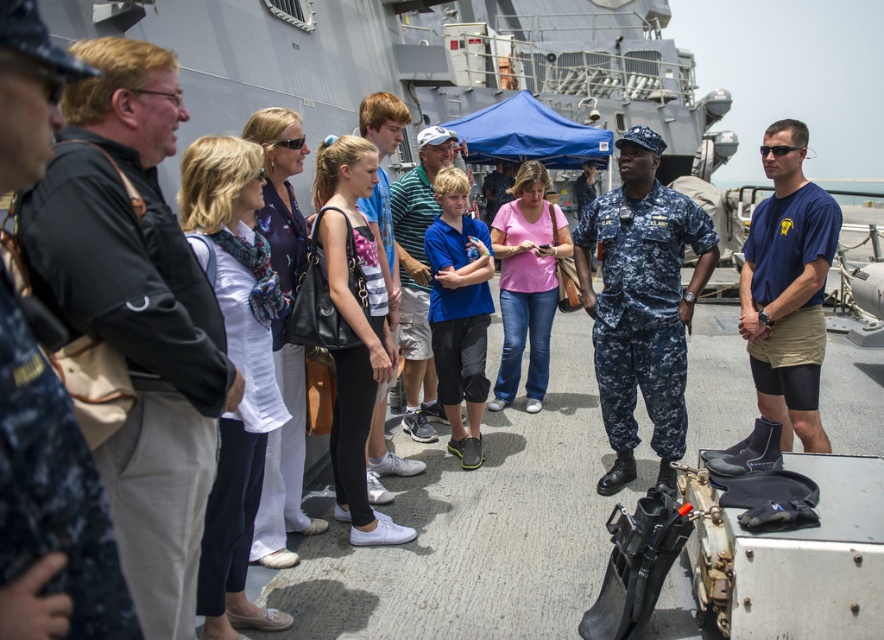
Is point (120, 529) more distant than point (418, 406)?

No, it is in front of (418, 406).

The image size is (884, 640). Identify the location of black leather jacket at left. (136, 314).

Who is positioned more to the right, black leather jacket at left or blue cotton t-shirt at center-right?

blue cotton t-shirt at center-right is more to the right.

Between black leather jacket at left and blue cotton t-shirt at center-right, which one is positioned lower?

black leather jacket at left is lower down.

Between point (75, 161) and point (789, 424), which one is positioned behind?

Positioned behind is point (789, 424).

Where is `black leather jacket at left`? This screenshot has height=640, width=884. black leather jacket at left is located at coordinates 136,314.

Who is more forward, (767, 349) or (398, 209)?

Point (767, 349) is more forward.

Does blue cotton t-shirt at center-right have a larger size compared to blue striped shirt at center?

Indeed, blue cotton t-shirt at center-right has a larger size compared to blue striped shirt at center.

Which is behind, point (760, 330) or point (429, 371)?

The point (429, 371) is behind.

Find the location of a particular element. Image resolution: width=884 pixels, height=640 pixels. blue cotton t-shirt at center-right is located at coordinates (789, 288).